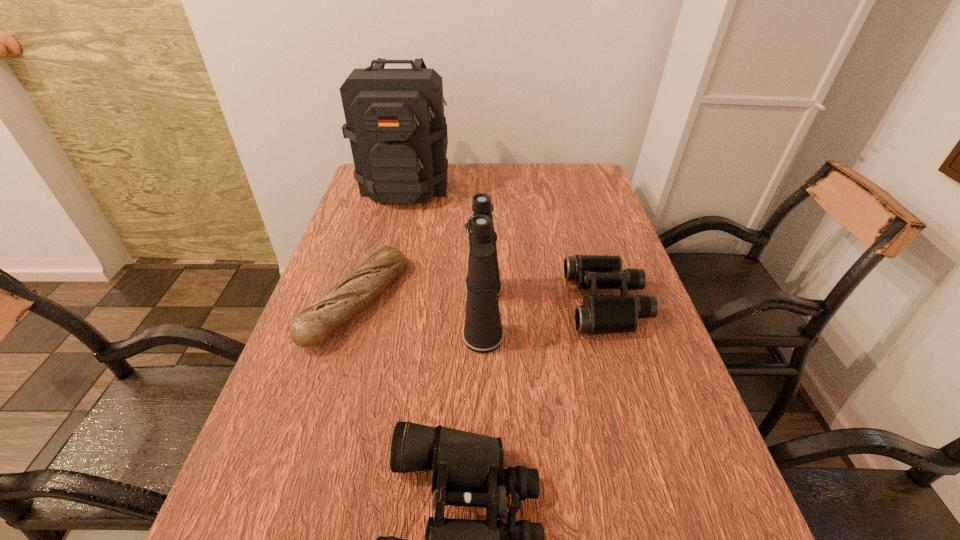
You are a GUI agent. You are given a task and a screenshot of the screen. Output one action in this format:
    pyautogui.click(x=<x>, y=<y>)
    Task: Click on the blank space located 0.150m on the right of the baguet
    
    Given the screenshot: What is the action you would take?
    pyautogui.click(x=462, y=302)

Identify the location of object that is at the far edge. (395, 122).

This screenshot has width=960, height=540. I want to click on backpack present at the left edge, so click(x=395, y=122).

Locate an element on the screen. baguet at the left edge is located at coordinates (350, 295).

Locate an element on the screen. The height and width of the screenshot is (540, 960). object that is at the right edge is located at coordinates (599, 314).

Locate an element on the screen. object that is at the far left corner is located at coordinates (395, 122).

In the image, there is a desktop. Where is `vacant space at the far edge`? vacant space at the far edge is located at coordinates (456, 183).

Where is `free space at the left edge of the desktop`? This screenshot has width=960, height=540. free space at the left edge of the desktop is located at coordinates (378, 296).

I want to click on vacant area at the right edge, so click(566, 200).

Where is `free location at the far right corner of the desktop`? free location at the far right corner of the desktop is located at coordinates (595, 173).